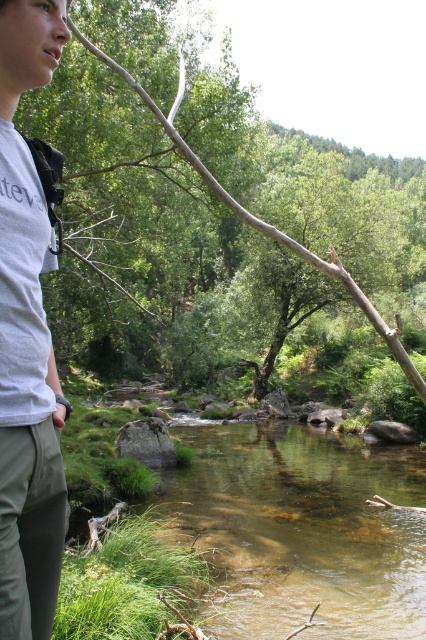
Question: Does clear water at center lie behind smooth brown branch at upper center?

Choices:
 (A) no
 (B) yes

Answer: (B)

Question: Which of the following is the closest to the observer?

Choices:
 (A) clear water at center
 (B) gray rough rock at center
 (C) smooth brown branch at upper center
 (D) white cotton shirt at left

Answer: (D)

Question: Is white cotton shirt at left above gray rough rock at center?

Choices:
 (A) yes
 (B) no

Answer: (A)

Question: Which point is closer to the camera?

Choices:
 (A) white cotton shirt at left
 (B) gray rough rock at center

Answer: (A)

Question: In this image, where is smooth brown branch at upper center located relative to gray rough rock at center?

Choices:
 (A) above
 (B) below

Answer: (A)

Question: Which object is farther from the camera taking this photo?

Choices:
 (A) clear water at center
 (B) white cotton shirt at left

Answer: (A)